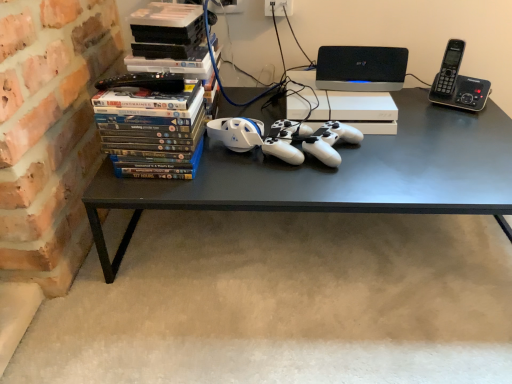
Locate an element on the screen. vacant region in front of black plastic speaker at upper center is located at coordinates (356, 98).